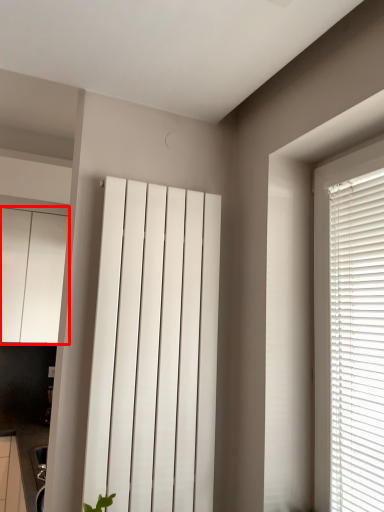
Question: From the image, what is the correct spatial relationship of cabinetry (annotated by the red box) in relation to curtain?

Choices:
 (A) left
 (B) right

Answer: (A)